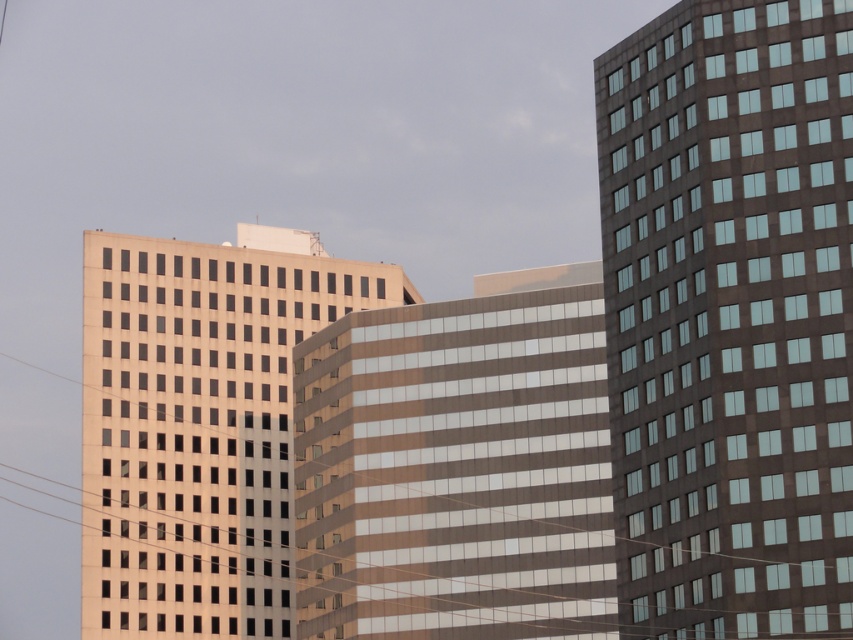
This screenshot has height=640, width=853. I want to click on dark glass building at right, so click(x=729, y=317).

Based on the photo, between dark glass building at right and brown glass building at center, which one appears on the left side from the viewer's perspective?

From the viewer's perspective, brown glass building at center appears more on the left side.

Measure the distance between dark glass building at right and camera.

They are 70.34 meters apart.

Identify the location of dark glass building at right. (729, 317).

Where is `brown glass building at center`? The height and width of the screenshot is (640, 853). brown glass building at center is located at coordinates (457, 467).

Which is in front, point (576, 362) or point (229, 368)?

Positioned in front is point (576, 362).

Describe the element at coordinates (457, 467) in the screenshot. I see `brown glass building at center` at that location.

You are a GUI agent. You are given a task and a screenshot of the screen. Output one action in this format:
    pyautogui.click(x=<x>, y=<y>)
    Task: Click on the brown glass building at center
    The height and width of the screenshot is (640, 853).
    Given the screenshot: What is the action you would take?
    pyautogui.click(x=457, y=467)

Who is positioned more to the right, dark glass building at right or matte glass building at center?

From the viewer's perspective, dark glass building at right appears more on the right side.

Does dark glass building at right appear over matte glass building at center?

Actually, dark glass building at right is below matte glass building at center.

Where is `dark glass building at right`? This screenshot has width=853, height=640. dark glass building at right is located at coordinates (729, 317).